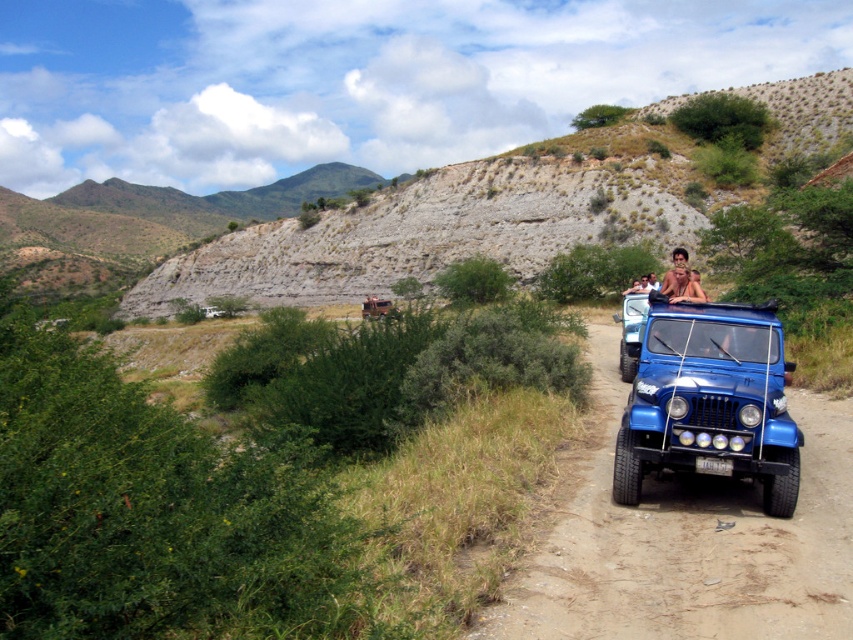
You are a hiker planning to climb the gray rocky hillside at upper center. You see the light brown leather jacket at center lying on the ground. Which object is higher in elevation?

The gray rocky hillside at upper center is located above the light brown leather jacket at center, so it has a higher elevation.

You are a photographer positioned at the front of the blue Jeep Wrangler. You want to capture a photo of the gray rocky hillside at upper center and the light brown leather jacket at center. Which object will appear wider in the photo?

The gray rocky hillside at upper center will appear wider in the photo because its width surpasses that of the light brown leather jacket at center.